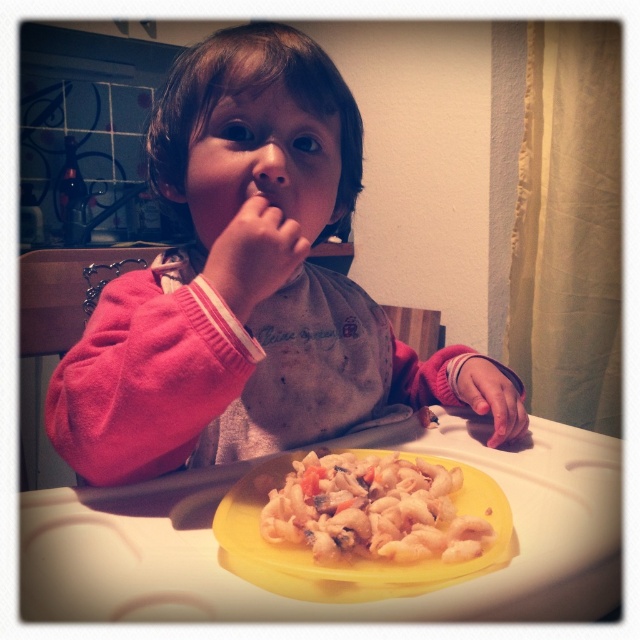
Between pink fleece sweater at center and pink fleece sleeve at lower right, which one is positioned higher?

pink fleece sweater at center

Is pink fleece sweater at center to the right of pink fleece sleeve at lower right from the viewer's perspective?

No, pink fleece sweater at center is not to the right of pink fleece sleeve at lower right.

Identify the location of pink fleece sweater at center. (237, 280).

Is point (305, 481) less distant than point (230, 232)?

That is True.

Is white matte pasta at center smaller than pink fabric hand at center?

Incorrect, white matte pasta at center is not smaller in size than pink fabric hand at center.

This screenshot has width=640, height=640. Describe the element at coordinates (372, 509) in the screenshot. I see `white matte pasta at center` at that location.

Locate an element on the screen. Image resolution: width=640 pixels, height=640 pixels. white matte pasta at center is located at coordinates (372, 509).

The image size is (640, 640). What are the coordinates of `yellow plastic tray at center` in the screenshot? It's located at (328, 604).

The height and width of the screenshot is (640, 640). What do you see at coordinates (328, 604) in the screenshot?
I see `yellow plastic tray at center` at bounding box center [328, 604].

Where is `yellow plastic tray at center`? Image resolution: width=640 pixels, height=640 pixels. yellow plastic tray at center is located at coordinates (328, 604).

At what (x,y) coordinates should I click in order to perform the action: click on yellow plastic tray at center. Please return your answer as a coordinate pair (x, y). This screenshot has height=640, width=640. Looking at the image, I should click on (328, 604).